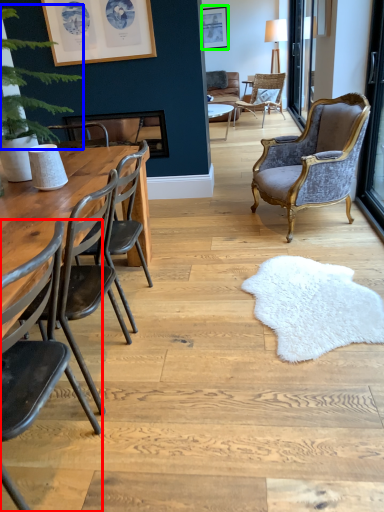
Question: Considering the real-world distances, which object is closest to chair (highlighted by a red box)? plant (highlighted by a blue box) or picture frame (highlighted by a green box).

Choices:
 (A) plant
 (B) picture frame

Answer: (A)